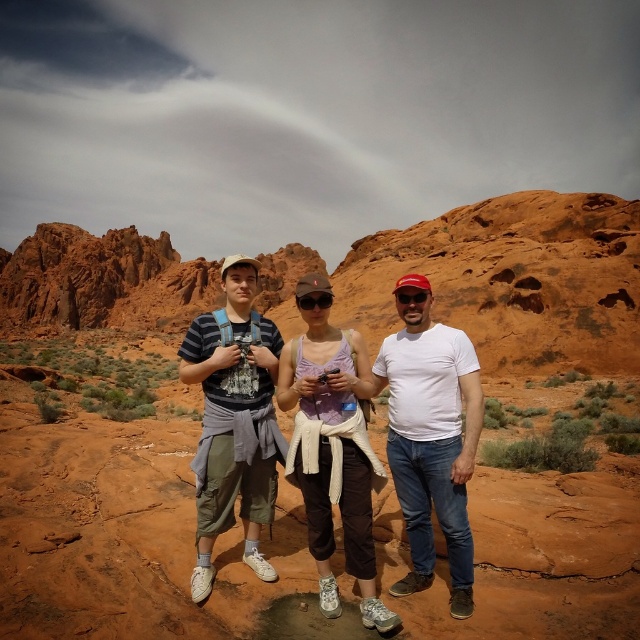
Does white matte shirt at center have a greater width compared to striped cotton shirt at center?

No, white matte shirt at center is not wider than striped cotton shirt at center.

Between white matte shirt at center and striped cotton shirt at center, which one appears on the left side from the viewer's perspective?

striped cotton shirt at center

Image resolution: width=640 pixels, height=640 pixels. What do you see at coordinates (429, 436) in the screenshot?
I see `white matte shirt at center` at bounding box center [429, 436].

At what (x,y) coordinates should I click in order to perform the action: click on white matte shirt at center. Please return your answer as a coordinate pair (x, y). Looking at the image, I should click on (429, 436).